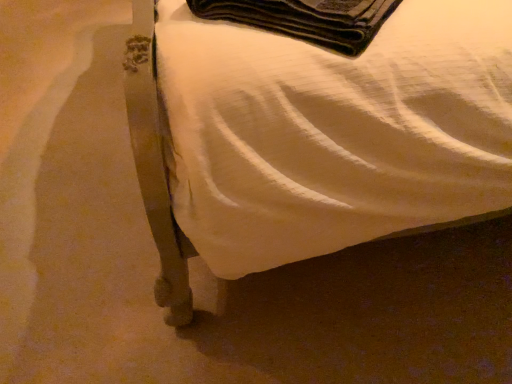
This screenshot has width=512, height=384. What do you see at coordinates (155, 168) in the screenshot?
I see `metallic bed frame at lower left` at bounding box center [155, 168].

The width and height of the screenshot is (512, 384). I want to click on metallic bed frame at lower left, so click(155, 168).

The width and height of the screenshot is (512, 384). What do you see at coordinates (306, 19) in the screenshot? I see `black felt wallet at upper center` at bounding box center [306, 19].

You are a GUI agent. You are given a task and a screenshot of the screen. Output one action in this format:
    pyautogui.click(x=<x>, y=<y>)
    Task: Click on the black felt wallet at upper center
    This screenshot has height=384, width=512.
    Given the screenshot: What is the action you would take?
    pyautogui.click(x=306, y=19)

Where is `metallic bed frame at lower left`? The image size is (512, 384). metallic bed frame at lower left is located at coordinates (155, 168).

In the image, is metallic bed frame at lower left on the left side or the right side of black felt wallet at upper center?

In the image, metallic bed frame at lower left appears on the right side of black felt wallet at upper center.

Is metallic bed frame at lower left closer to camera compared to black felt wallet at upper center?

Yes, metallic bed frame at lower left is closer to the camera.

Which point is more distant from viewer, (170, 269) or (308, 25)?

Positioned behind is point (170, 269).

From the image's perspective, who appears lower, metallic bed frame at lower left or black felt wallet at upper center?

black felt wallet at upper center is shown below in the image.

In the scene shown: From a real-world perspective, between metallic bed frame at lower left and black felt wallet at upper center, who is vertically lower?

metallic bed frame at lower left, from a real-world perspective.

Does metallic bed frame at lower left have a greater width compared to black felt wallet at upper center?

Indeed, metallic bed frame at lower left has a greater width compared to black felt wallet at upper center.

From their relative heights in the image, would you say metallic bed frame at lower left is taller or shorter than black felt wallet at upper center?

metallic bed frame at lower left is taller than black felt wallet at upper center.

Considering the relative sizes of metallic bed frame at lower left and black felt wallet at upper center in the image provided, is metallic bed frame at lower left smaller than black felt wallet at upper center?

No.

Would you say metallic bed frame at lower left is inside or outside black felt wallet at upper center?

metallic bed frame at lower left cannot be found inside black felt wallet at upper center.

Is metallic bed frame at lower left not near black felt wallet at upper center?

No, there isn't a large distance between metallic bed frame at lower left and black felt wallet at upper center.

Is metallic bed frame at lower left facing away from black felt wallet at upper center?

No.

Looking at this image, what's the angular difference between metallic bed frame at lower left and black felt wallet at upper center's facing directions?

There is a 38.6-degree angle between the facing directions of metallic bed frame at lower left and black felt wallet at upper center.

At what (x,y) coordinates should I click in order to perform the action: click on blanket that is below the metallic bed frame at lower left (from the image's perspective). Please return your answer as a coordinate pair (x, y). Looking at the image, I should click on (306, 19).

Considering the positions of objects black felt wallet at upper center and metallic bed frame at lower left in the image provided, who is more to the right, black felt wallet at upper center or metallic bed frame at lower left?

metallic bed frame at lower left.

Relative to metallic bed frame at lower left, is black felt wallet at upper center in front or behind?

Visually, black felt wallet at upper center is located behind metallic bed frame at lower left.

Does point (361, 23) come behind point (155, 160)?

Yes.

From the image's perspective, is black felt wallet at upper center on metallic bed frame at lower left?

Actually, black felt wallet at upper center appears below metallic bed frame at lower left in the image.

From a real-world perspective, between black felt wallet at upper center and metallic bed frame at lower left, who is vertically higher?

black felt wallet at upper center, from a real-world perspective.

Can you confirm if black felt wallet at upper center is thinner than metallic bed frame at lower left?

Indeed, black felt wallet at upper center has a lesser width compared to metallic bed frame at lower left.

Between black felt wallet at upper center and metallic bed frame at lower left, which one has less height?

With less height is black felt wallet at upper center.

Between black felt wallet at upper center and metallic bed frame at lower left, which one has larger size?

Bigger between the two is metallic bed frame at lower left.

Is metallic bed frame at lower left surrounded by black felt wallet at upper center?

No, black felt wallet at upper center does not contain metallic bed frame at lower left.

Would you say black felt wallet at upper center is a long distance from metallic bed frame at lower left?

black felt wallet at upper center is actually quite close to metallic bed frame at lower left.

Is black felt wallet at upper center oriented towards metallic bed frame at lower left?

Yes, black felt wallet at upper center faces towards metallic bed frame at lower left.

How many degrees apart are the facing directions of black felt wallet at upper center and metallic bed frame at lower left?

They differ by 38.6 degrees in their facing directions.

In order to click on blanket to the left of metallic bed frame at lower left in this screenshot , I will do `click(306, 19)`.

In order to click on furniture that appears below the black felt wallet at upper center (from a real-world perspective) in this screenshot , I will do `click(155, 168)`.

Identify the location of blanket that is behind the metallic bed frame at lower left. The height and width of the screenshot is (384, 512). (306, 19).